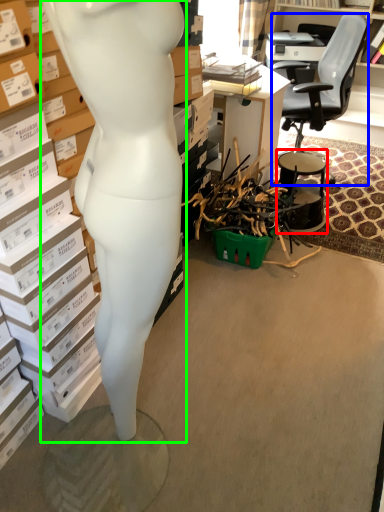
Question: Based on their relative distances, which object is farther from drum (highlighted by a red box)? Choose from chair (highlighted by a blue box) and person (highlighted by a green box).

Choices:
 (A) chair
 (B) person

Answer: (B)